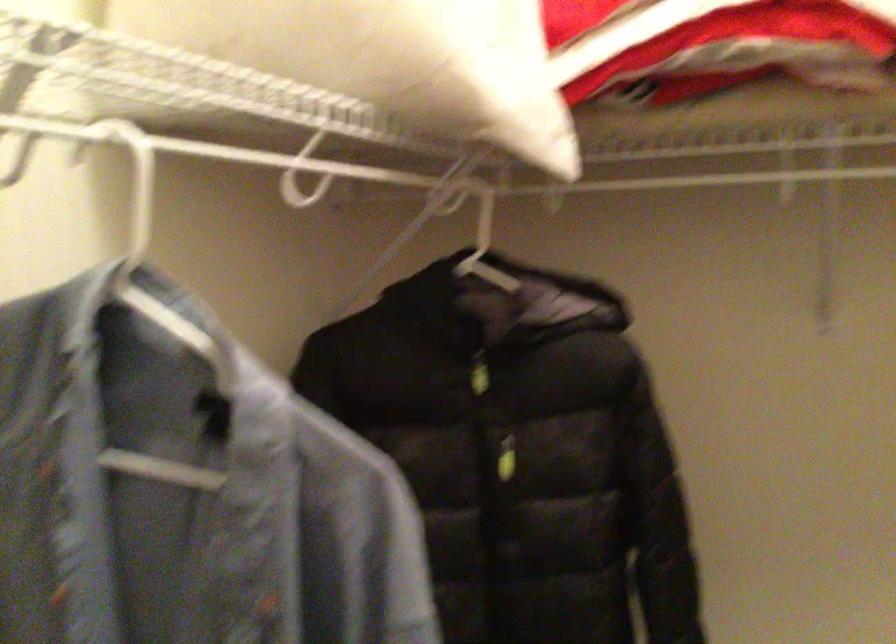
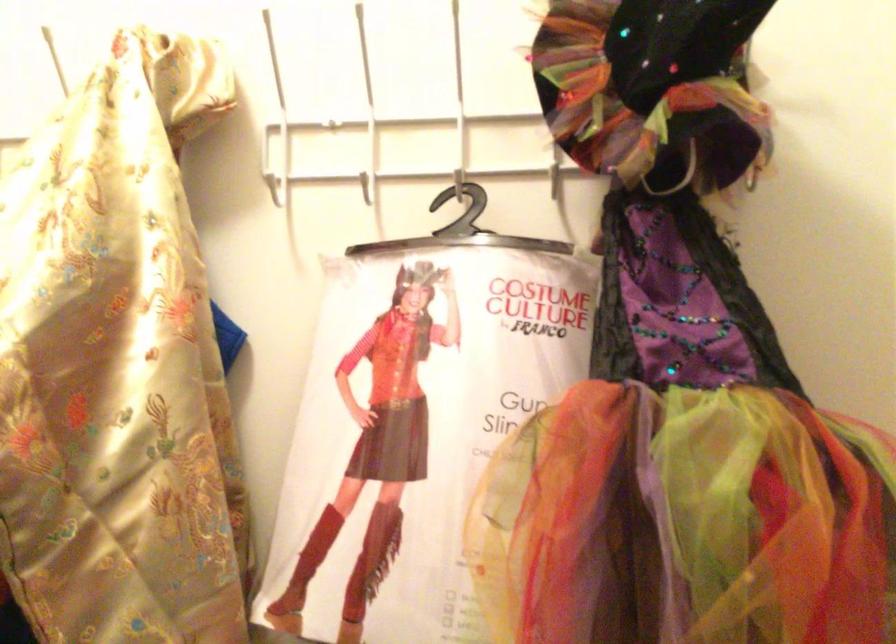
Question: The camera is either moving clockwise (left) or counter-clockwise (right) around the object. The first image is from the beginning of the video and the second image is from the end. Is the camera moving left or right when shooting the video?

Choices:
 (A) Left
 (B) Right

Answer: (A)